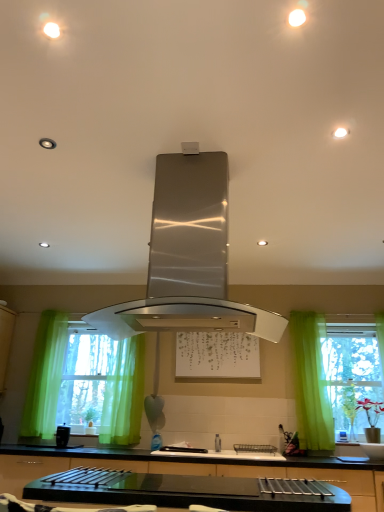
Locate an element on the screen. green sheer curtains at left is located at coordinates (85, 382).

Describe the element at coordinates (217, 356) in the screenshot. I see `white matte bulletin board at center` at that location.

From the picture: In order to face matte black coffee maker at lower left, should I rotate leftwards or rightwards?

Rotate your view left by about 16.636°.

Find the location of `black glossy countertop at center`. black glossy countertop at center is located at coordinates (192, 469).

Locate an element on the screen. The image size is (384, 512). green sheer curtains at left is located at coordinates (85, 382).

Considering the positions of objects green sheer curtains at left and satin silver range hood at center in the image provided, who is more to the right, green sheer curtains at left or satin silver range hood at center?

satin silver range hood at center.

Is point (113, 418) less distant than point (225, 194)?

That is False.

Consider the image. From a real-world perspective, is green sheer curtains at left positioned over satin silver range hood at center based on gravity?

No, from a real-world perspective, green sheer curtains at left is not above satin silver range hood at center.

Is green sheer curtains at left taller than satin silver range hood at center?

Yes.

Which of these two, matte black coffee maker at lower left or green sheer curtain at center, which is the first curtain from left to right, stands shorter?

Standing shorter between the two is matte black coffee maker at lower left.

Is matte black coffee maker at lower left facing towards green sheer curtain at center, placed as the second curtain when sorted from right to left?

No, matte black coffee maker at lower left is not turned towards green sheer curtain at center, placed as the second curtain when sorted from right to left.

Which object is more forward, matte black coffee maker at lower left or green sheer curtain at center, placed as the second curtain when sorted from right to left?

matte black coffee maker at lower left is closer to the camera.

Considering the relative sizes of matte black coffee maker at lower left and green sheer curtain at center, placed as the second curtain when sorted from right to left, in the image provided, is matte black coffee maker at lower left wider than green sheer curtain at center, placed as the second curtain when sorted from right to left,?

No, matte black coffee maker at lower left is not wider than green sheer curtain at center, placed as the second curtain when sorted from right to left.

In the scene shown: Is green sheer curtain at center, which is the first curtain from left to right, thinner than black glossy countertop at center?

Yes.

Does green sheer curtain at center, placed as the second curtain when sorted from right to left, come in front of black glossy countertop at center?

No, it is behind black glossy countertop at center.

How far apart are green sheer curtain at center, placed as the second curtain when sorted from right to left, and black glossy countertop at center?

A distance of 82.03 centimeters exists between green sheer curtain at center, placed as the second curtain when sorted from right to left, and black glossy countertop at center.

Is the surface of matte black coffee maker at lower left in direct contact with satin silver range hood at center?

No, matte black coffee maker at lower left is not in contact with satin silver range hood at center.

Which is nearer, (x=58, y=428) or (x=216, y=172)?

Point (x=58, y=428) is positioned farther from the camera compared to point (x=216, y=172).

The image size is (384, 512). Identify the location of home appliance above the matte black coffee maker at lower left (from a real-world perspective). (188, 258).

Can you confirm if matte black coffee maker at lower left is thinner than satin silver range hood at center?

Indeed, matte black coffee maker at lower left has a lesser width compared to satin silver range hood at center.

Does black glossy countertop at center have a greater height compared to matte black coffee maker at lower left?

Indeed, black glossy countertop at center has a greater height compared to matte black coffee maker at lower left.

Is black glossy countertop at center outside of matte black coffee maker at lower left?

That's correct, black glossy countertop at center is outside of matte black coffee maker at lower left.

The image size is (384, 512). What are the coordinates of `countertop that is below the matte black coffee maker at lower left (from the image's perspective)` in the screenshot? It's located at (192, 469).

How many degrees apart are the facing directions of black glossy countertop at center and matte black coffee maker at lower left?

The angle between the facing direction of black glossy countertop at center and the facing direction of matte black coffee maker at lower left is 0.41 degrees.

Is the depth of green sheer curtain at center, placed as the second curtain when sorted from right to left, less than that of green sheer curtain at right, acting as the first curtain starting from the right?

That is False.

Is green sheer curtain at right, acting as the first curtain starting from the right, a part of green sheer curtain at center, which is the first curtain from left to right?

No, green sheer curtain at right, acting as the first curtain starting from the right, is not a part of green sheer curtain at center, which is the first curtain from left to right.

Considering the positions of objects green sheer curtain at center, which is the first curtain from left to right, and green sheer curtain at right, acting as the first curtain starting from the right, in the image provided, who is more to the left, green sheer curtain at center, which is the first curtain from left to right, or green sheer curtain at right, acting as the first curtain starting from the right,?

green sheer curtain at center, which is the first curtain from left to right.

From the image's perspective, does green sheer curtain at center, which is the first curtain from left to right, appear higher than green sheer curtain at right, acting as the first curtain starting from the right?

Actually, green sheer curtain at center, which is the first curtain from left to right, appears below green sheer curtain at right, acting as the first curtain starting from the right, in the image.

From a real-world perspective, relative to satin nickel faucet at center, is green sheer curtain at right, acting as the first curtain starting from the right, vertically above or below?

green sheer curtain at right, acting as the first curtain starting from the right, is situated higher than satin nickel faucet at center in the real world.

Is green sheer curtain at right, acting as the 2th curtain starting from the left, not within satin nickel faucet at center?

Indeed, green sheer curtain at right, acting as the 2th curtain starting from the left, is completely outside satin nickel faucet at center.

Looking at their sizes, would you say green sheer curtain at right, acting as the first curtain starting from the right, is wider or thinner than satin nickel faucet at center?

green sheer curtain at right, acting as the first curtain starting from the right, is thinner than satin nickel faucet at center.

Between green sheer curtain at right, acting as the first curtain starting from the right, and satin nickel faucet at center, which one appears on the right side from the viewer's perspective?

From the viewer's perspective, green sheer curtain at right, acting as the first curtain starting from the right, appears more on the right side.

The image size is (384, 512). What are the coordinates of `window to the left of satin silver range hood at center` in the screenshot? It's located at (85, 382).

Locate an element on the screen. The height and width of the screenshot is (512, 384). the 1st curtain above when counting from the matte black coffee maker at lower left (from the image's perspective) is located at coordinates (124, 395).

Looking at the image, which one is located closer to green sheer curtains at left, green sheer curtain at right, acting as the first curtain starting from the right, or satin nickel faucet at center?

satin nickel faucet at center is positioned closer to the anchor green sheer curtains at left.

From the image, which object appears to be nearer to green sheer curtain at center, which is the first curtain from left to right, green sheer curtains at left or satin silver range hood at center?

The object closer to green sheer curtain at center, which is the first curtain from left to right, is green sheer curtains at left.

From the image, which object appears to be nearer to matte black coffee maker at lower left, satin nickel faucet at center or satin silver range hood at center?

The object closer to matte black coffee maker at lower left is satin nickel faucet at center.

Based on their spatial positions, is white matte bulletin board at center or satin nickel faucet at center further from black glossy countertop at center?

satin nickel faucet at center.

Looking at the image, which one is located further to green sheer curtain at center, which is the first curtain from left to right, white matte bulletin board at center or green sheer curtains at left?

Based on the image, white matte bulletin board at center appears to be further to green sheer curtain at center, which is the first curtain from left to right.

From the image, which object appears to be nearer to black glossy countertop at center, satin nickel faucet at center or matte black coffee maker at lower left?

Among the two, matte black coffee maker at lower left is located nearer to black glossy countertop at center.

Based on the photo, when comparing their distances from matte black coffee maker at lower left, does satin silver range hood at center or green sheer curtains at left seem closer?

green sheer curtains at left.

Which object lies nearer to the anchor point satin silver range hood at center, matte black coffee maker at lower left or green sheer curtain at center, placed as the second curtain when sorted from right to left?

green sheer curtain at center, placed as the second curtain when sorted from right to left, is closer to satin silver range hood at center.

Where is `countertop between matte black coffee maker at lower left and green sheer curtain at right, acting as the first curtain starting from the right, from left to right`? countertop between matte black coffee maker at lower left and green sheer curtain at right, acting as the first curtain starting from the right, from left to right is located at coordinates (192, 469).

The height and width of the screenshot is (512, 384). What are the coordinates of `faucet positioned between satin silver range hood at center and green sheer curtain at right, acting as the first curtain starting from the right, from near to far` in the screenshot? It's located at (218, 443).

Locate an element on the screen. bulletin board between matte black coffee maker at lower left and green sheer curtain at right, acting as the 2th curtain starting from the left, from left to right is located at coordinates (217, 356).

Locate an element on the screen. home appliance situated between matte black coffee maker at lower left and green sheer curtain at right, acting as the 2th curtain starting from the left, from left to right is located at coordinates (188, 258).